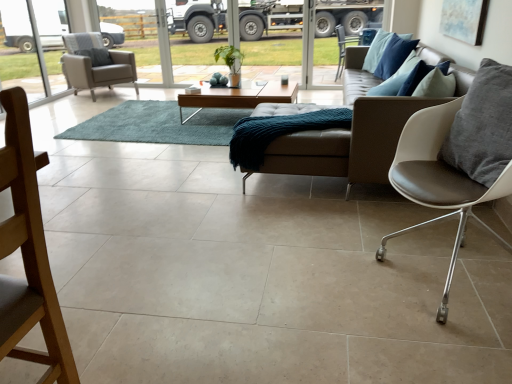
Question: From a real-world perspective, is light brown wooden coffee table at center physically below teal shaggy rug at center?

Choices:
 (A) no
 (B) yes

Answer: (A)

Question: Is light brown wooden coffee table at center at the right side of teal shaggy rug at center?

Choices:
 (A) yes
 (B) no

Answer: (A)

Question: Is light brown wooden coffee table at center with teal shaggy rug at center?

Choices:
 (A) yes
 (B) no

Answer: (B)

Question: Is light brown wooden coffee table at center outside teal shaggy rug at center?

Choices:
 (A) no
 (B) yes

Answer: (B)

Question: From the image's perspective, is light brown wooden coffee table at center on top of teal shaggy rug at center?

Choices:
 (A) yes
 (B) no

Answer: (A)

Question: Does light brown wooden coffee table at center have a greater width compared to teal shaggy rug at center?

Choices:
 (A) no
 (B) yes

Answer: (A)

Question: From the image's perspective, is matte blue painting at upper right located beneath leather couch at center?

Choices:
 (A) yes
 (B) no

Answer: (B)

Question: From a real-world perspective, is matte blue painting at upper right located higher than leather couch at center?

Choices:
 (A) yes
 (B) no

Answer: (A)

Question: Can you confirm if matte blue painting at upper right is bigger than leather couch at center?

Choices:
 (A) no
 (B) yes

Answer: (A)

Question: Does matte blue painting at upper right have a smaller size compared to leather couch at center?

Choices:
 (A) no
 (B) yes

Answer: (B)

Question: Considering the relative sizes of matte blue painting at upper right and leather couch at center in the image provided, is matte blue painting at upper right shorter than leather couch at center?

Choices:
 (A) yes
 (B) no

Answer: (A)

Question: Can you confirm if matte blue painting at upper right is positioned to the left of leather couch at center?

Choices:
 (A) no
 (B) yes

Answer: (A)

Question: From the image's perspective, would you say white leather chair at right, the 2th chair from the bottom, is positioned over gray leather pillow at right?

Choices:
 (A) yes
 (B) no

Answer: (B)